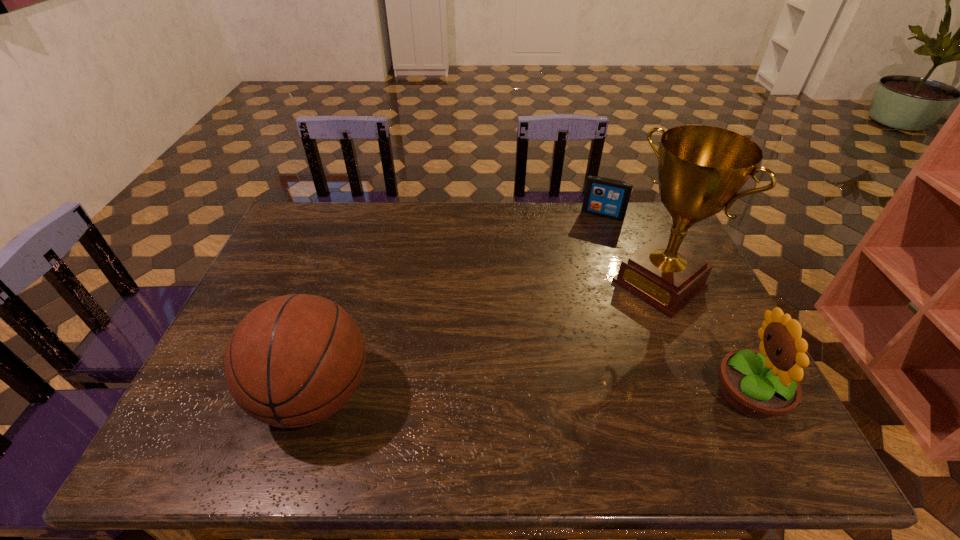
Where is `vacant area at the far right corner of the desktop`? vacant area at the far right corner of the desktop is located at coordinates click(653, 226).

Identify the location of empty space that is in between the leftmost object and the award. (x=487, y=339).

The width and height of the screenshot is (960, 540). In order to click on vacant region between the basketball and the shortest object in this screenshot , I will do `click(458, 305)`.

Locate an element on the screen. free space between the basketball and the sunflower is located at coordinates (531, 395).

Where is `free space between the award and the basketball`? free space between the award and the basketball is located at coordinates (487, 339).

This screenshot has height=540, width=960. Find the location of `blank region between the sunflower and the basketball`. blank region between the sunflower and the basketball is located at coordinates (531, 395).

Identify the location of blank region between the award and the shortest object. (631, 249).

Where is `vacant area between the leftmost object and the second farthest object`? vacant area between the leftmost object and the second farthest object is located at coordinates (487, 339).

I want to click on vacant area between the leftmost object and the sunflower, so [x=531, y=395].

You are a GUI agent. You are given a task and a screenshot of the screen. Output one action in this format:
    pyautogui.click(x=<x>, y=<y>)
    Task: Click on the second closest object to the sunflower
    
    Given the screenshot: What is the action you would take?
    tap(604, 197)